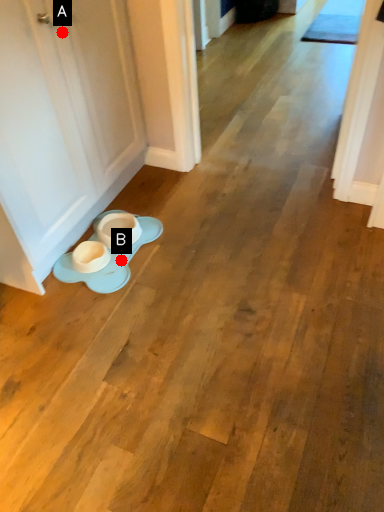
Question: Two points are circled on the image, labeled by A and B beside each circle. Which point is closer to the camera?

Choices:
 (A) A is closer
 (B) B is closer

Answer: (A)